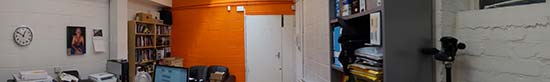
Identify the location of fan. This screenshot has height=82, width=550. (141, 76).